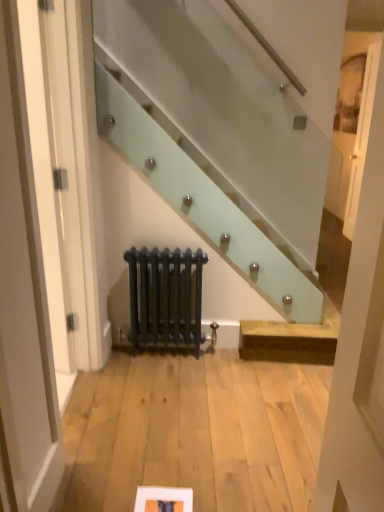
The width and height of the screenshot is (384, 512). In order to click on vacant area that is situated to the right of matte black radiator at center in this screenshot , I will do `click(229, 362)`.